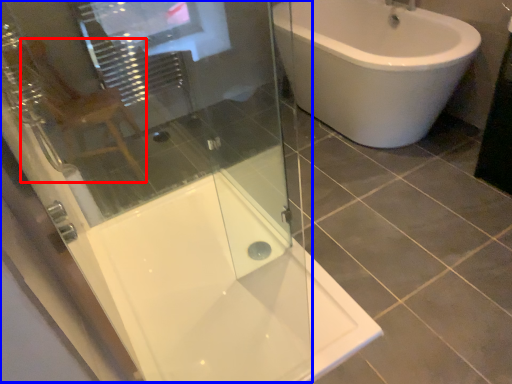
Question: Which point is closer to the camera, gray (highlighted by a red box) or screen door (highlighted by a blue box)?

Choices:
 (A) gray
 (B) screen door

Answer: (B)